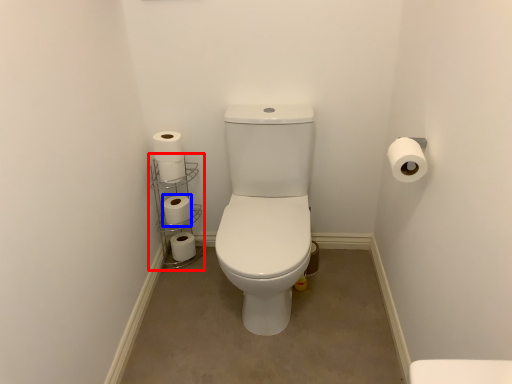
Question: Which object appears farthest to the camera in this image, shelf (highlighted by a red box) or toilet paper (highlighted by a blue box)?

Choices:
 (A) shelf
 (B) toilet paper

Answer: (B)